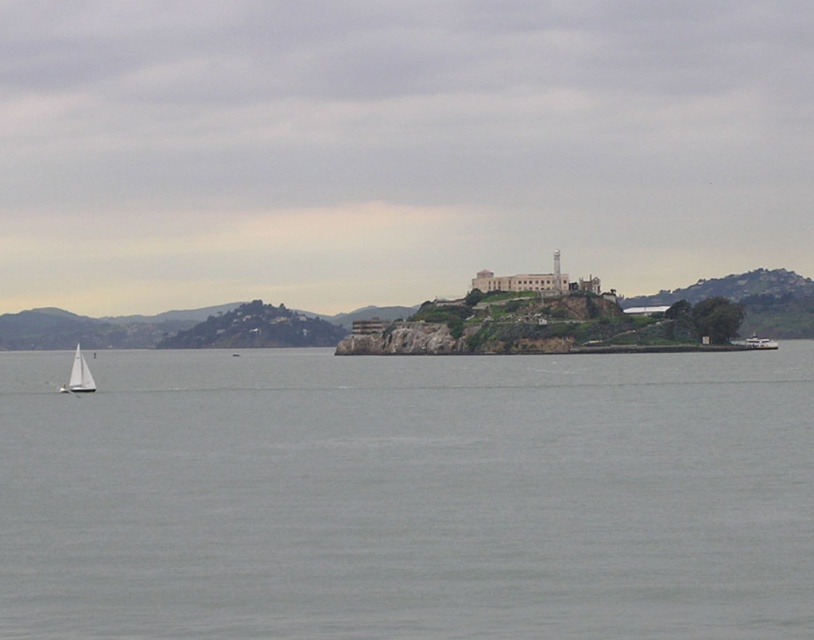
Question: Among these objects, which one is farthest from the camera?

Choices:
 (A) white matte sailboat at lower left
 (B) gray water at lower left

Answer: (A)

Question: Does gray water at lower left have a lesser width compared to white matte sailboat at lower left?

Choices:
 (A) no
 (B) yes

Answer: (A)

Question: Is gray water at lower left above white matte sailboat at lower left?

Choices:
 (A) no
 (B) yes

Answer: (B)

Question: Is gray water at lower left to the left of white matte sailboat at lower left from the viewer's perspective?

Choices:
 (A) yes
 (B) no

Answer: (B)